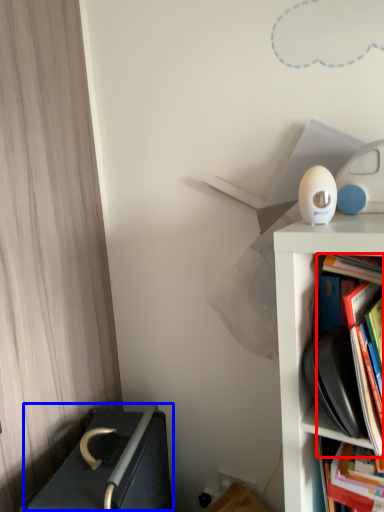
Question: Which of the following is the closest to the observer, book (highlighted by a red box) or writing (highlighted by a blue box)?

Choices:
 (A) book
 (B) writing

Answer: (A)